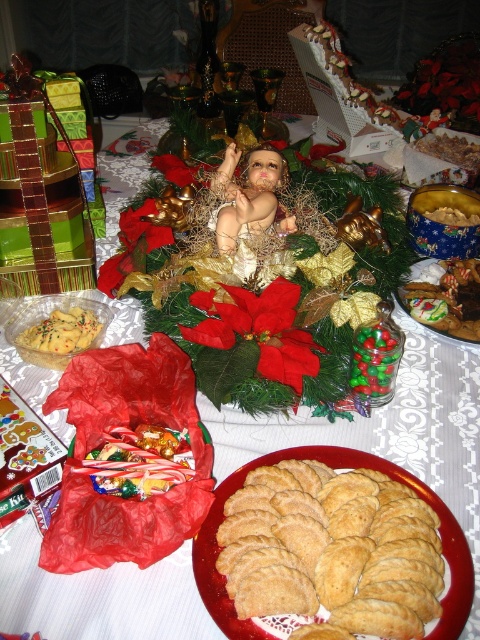
Question: Among these objects, which one is nearest to the camera?

Choices:
 (A) satin brown cookies at center
 (B) matte yellow cookies at center-left
 (C) shiny chocolate cookies at center
 (D) golden brown cookie at center

Answer: (D)

Question: In this image, where is matte yellow cookies at center-left located relative to satin brown cookies at center?

Choices:
 (A) left
 (B) right

Answer: (A)

Question: Is smooth porcelain baby at center bigger than satin brown cookies at center?

Choices:
 (A) no
 (B) yes

Answer: (B)

Question: Can you confirm if smooth porcelain baby at center is thinner than satin brown cookies at center?

Choices:
 (A) yes
 (B) no

Answer: (A)

Question: Which point is closer to the camera taking this photo?

Choices:
 (A) (79, 308)
 (B) (462, 144)
 (C) (322, 602)

Answer: (C)

Question: Estimate the real-world distances between objects in this image. Which object is closer to the satin brown cookies at center?

Choices:
 (A) matte yellow cookies at center-left
 (B) shiny chocolate cookies at center
 (C) golden brown cookie at center
 (D) smooth porcelain baby at center

Answer: (B)